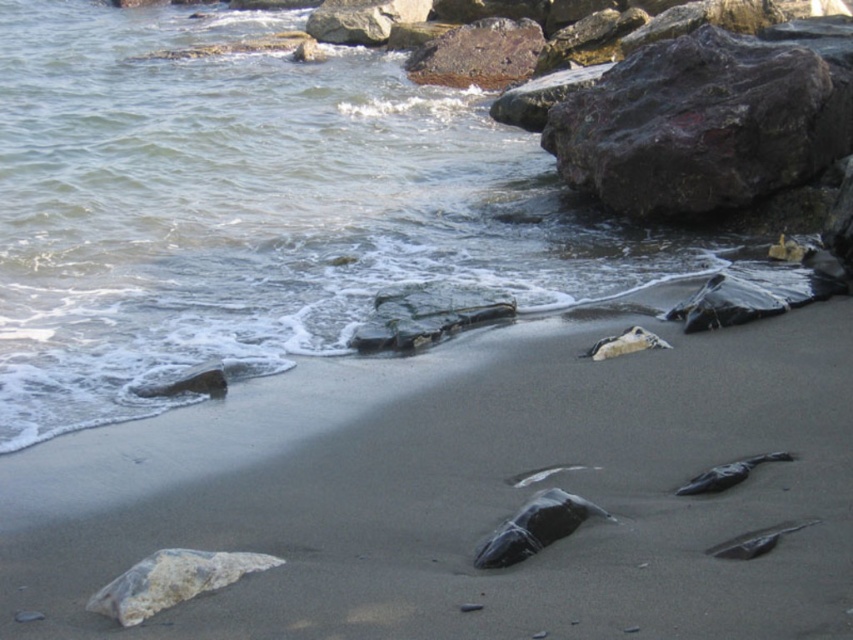
Which is above, smooth sand at lower center or rusty metallic rock at upper right?

rusty metallic rock at upper right

Between point (665, 369) and point (679, 209), which one is positioned in front?

Positioned in front is point (665, 369).

The width and height of the screenshot is (853, 640). I want to click on smooth sand at lower center, so click(x=466, y=492).